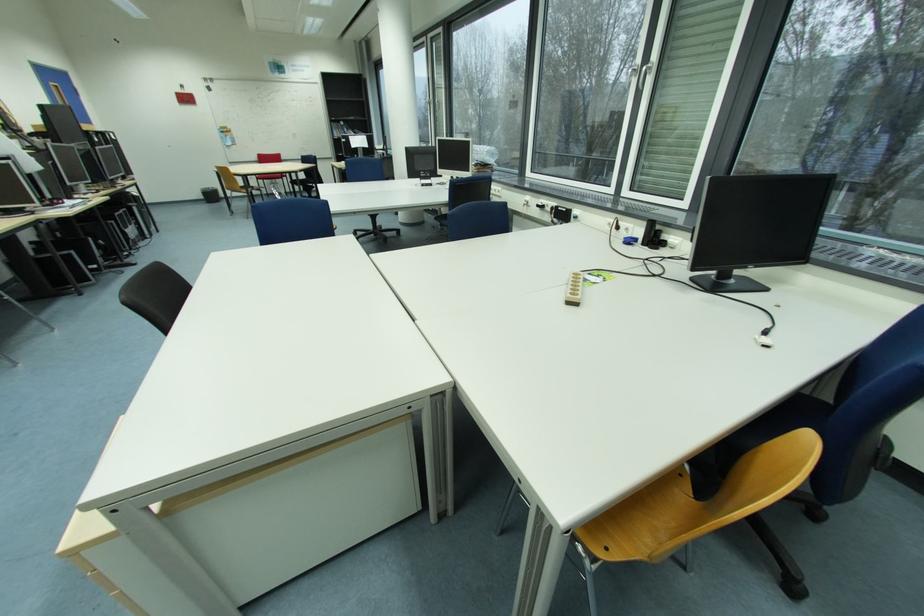
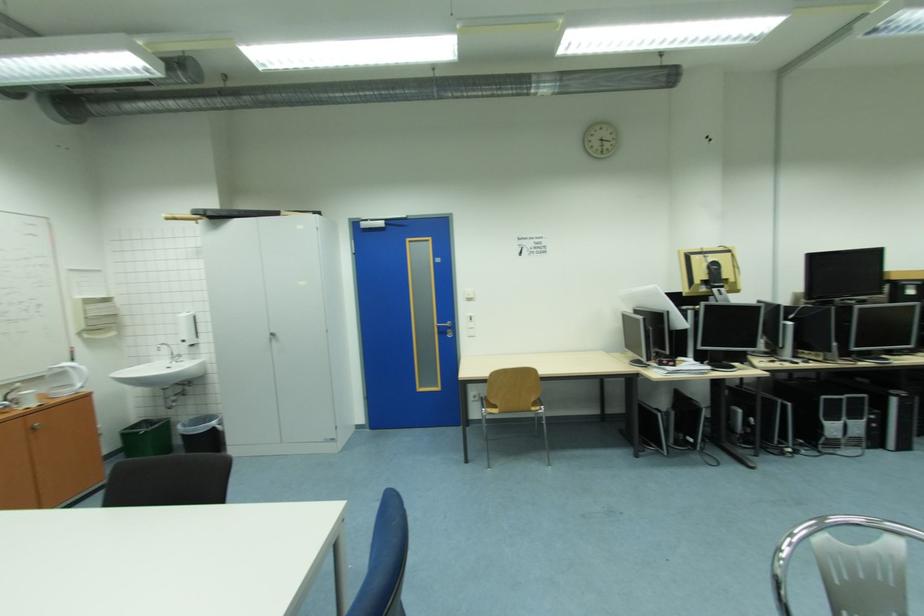
Find the pixel in the second image that matches (x=141, y=209) in the first image.

(901, 400)